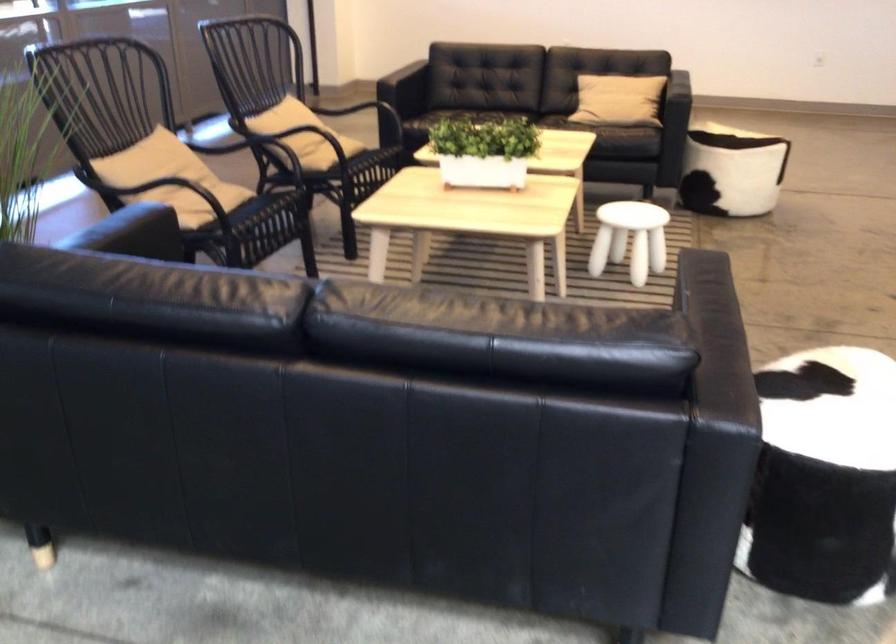
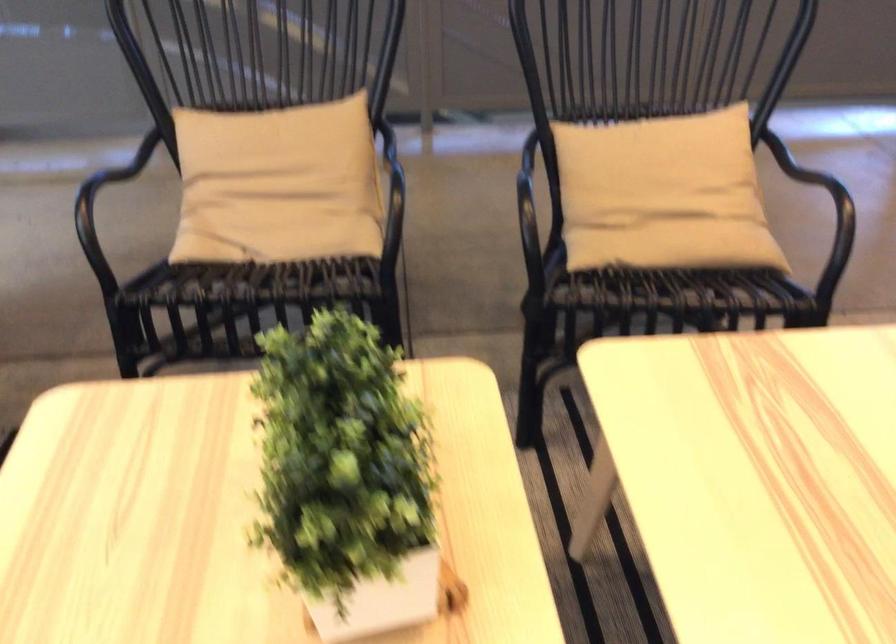
Locate, in the second image, the point that corresponds to (316,131) in the first image.

(662, 194)